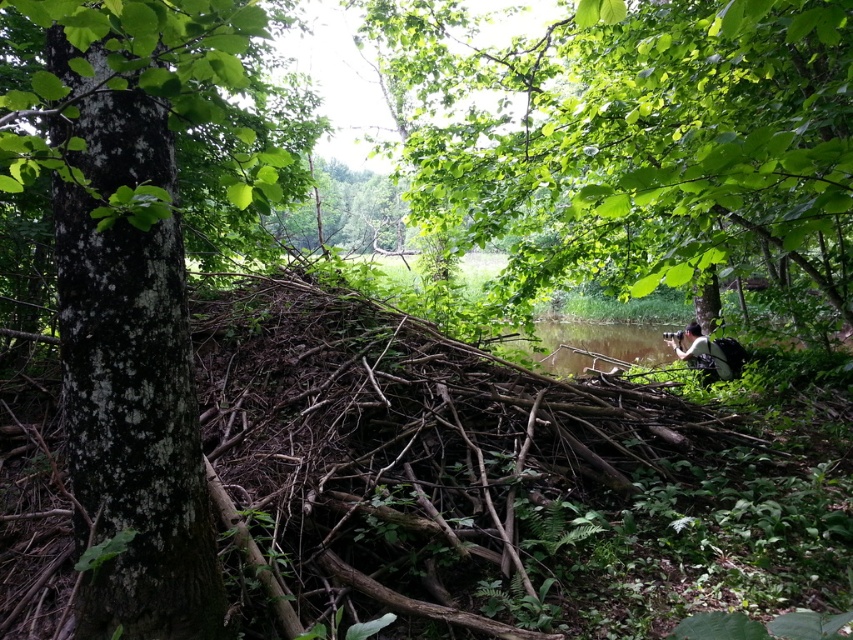
Question: Is green rough bark tree at left further to the viewer compared to white fabric camera at center-right?

Choices:
 (A) yes
 (B) no

Answer: (B)

Question: Can you confirm if green leafy tree at center is bigger than green rough bark tree at left?

Choices:
 (A) yes
 (B) no

Answer: (B)

Question: Among these objects, which one is nearest to the camera?

Choices:
 (A) green rough bark tree at left
 (B) white fabric camera at center-right

Answer: (A)

Question: In this image, where is green leafy tree at center located relative to green rough bark tree at left?

Choices:
 (A) left
 (B) right

Answer: (B)

Question: Which point is farther to the camera?

Choices:
 (A) white fabric camera at center-right
 (B) green leafy tree at center

Answer: (A)

Question: Which of the following is the farthest from the observer?

Choices:
 (A) (122, 442)
 (B) (727, 118)
 (C) (718, 348)

Answer: (C)